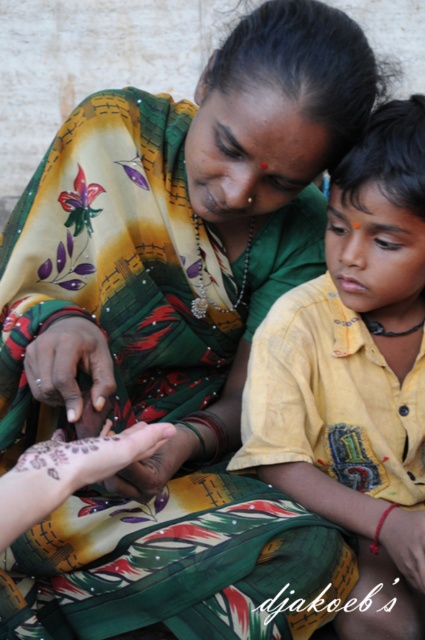
Can you confirm if yellow cotton shirt at center is taller than matte skin at center?

Indeed, yellow cotton shirt at center has a greater height compared to matte skin at center.

What do you see at coordinates (354, 369) in the screenshot? I see `yellow cotton shirt at center` at bounding box center [354, 369].

Locate an element on the screen. yellow cotton shirt at center is located at coordinates tap(354, 369).

Between dark skin hand at center and smooth skin hand at center, which one has more height?

Standing taller between the two is dark skin hand at center.

Is dark skin hand at center below smooth skin hand at center?

No, dark skin hand at center is not below smooth skin hand at center.

In order to click on dark skin hand at center in this screenshot , I will do `click(70, 364)`.

Which is behind, point (62, 336) or point (186, 444)?

The point (186, 444) is more distant.

Is dark skin hand at center above matte skin at center?

Yes, dark skin hand at center is above matte skin at center.

Who is more distant from viewer, [98,337] or [150,472]?

The point [150,472] is more distant.

At what (x,y) coordinates should I click in order to perform the action: click on dark skin hand at center. Please return your answer as a coordinate pair (x, y). Looking at the image, I should click on (70, 364).